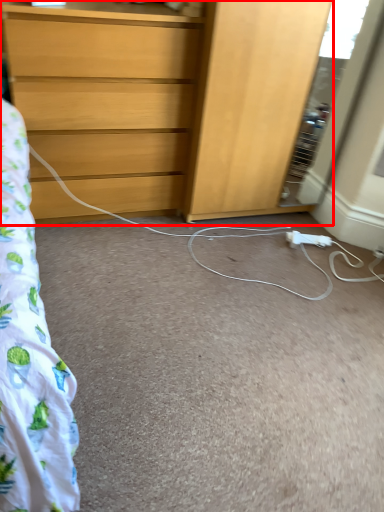
Question: Observing the image, what is the correct spatial positioning of chest of drawers (annotated by the red box) in reference to extension cord?

Choices:
 (A) right
 (B) left

Answer: (B)